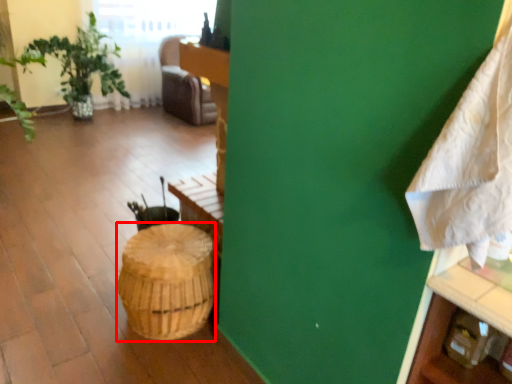
Question: From the image's perspective, considering the relative positions of basket (annotated by the red box) and blanket in the image provided, where is basket (annotated by the red box) located with respect to the staircase?

Choices:
 (A) above
 (B) below

Answer: (B)